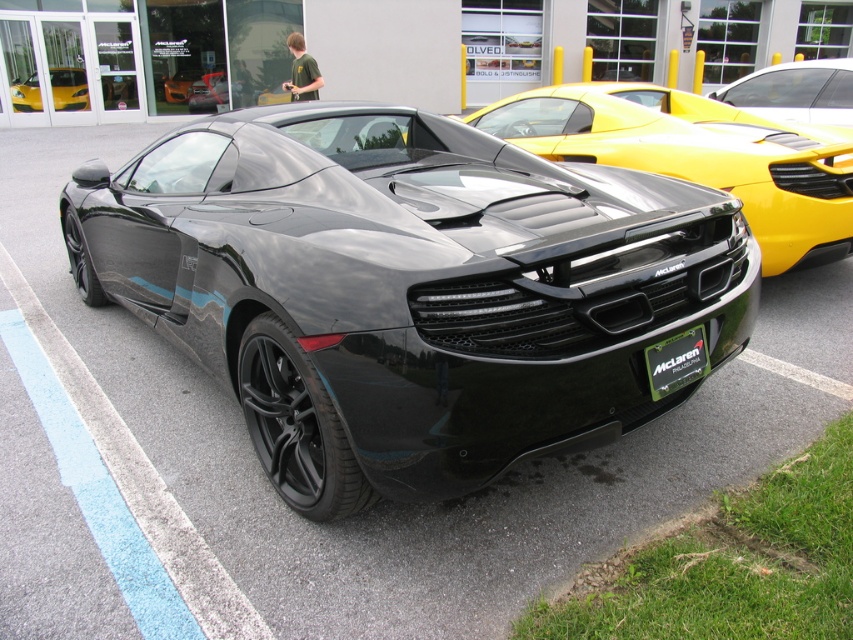
Describe the element at coordinates (212, 92) in the screenshot. I see `glossy black car at center` at that location.

Which is below, glossy black car at center or black matte sports car at center?

black matte sports car at center

Which is behind, point (189, 100) or point (286, 100)?

Positioned behind is point (189, 100).

At what (x,y) coordinates should I click in order to perform the action: click on glossy black car at center. Please return your answer as a coordinate pair (x, y). This screenshot has width=853, height=640. Looking at the image, I should click on (212, 92).

Is green matte license plate at rear thinner than glossy black car at center?

Indeed, green matte license plate at rear has a lesser width compared to glossy black car at center.

This screenshot has width=853, height=640. What do you see at coordinates (676, 362) in the screenshot?
I see `green matte license plate at rear` at bounding box center [676, 362].

Find the location of a particular element. green matte license plate at rear is located at coordinates (676, 362).

Is green matte license plate at rear bigger than black matte sports car at center?

Incorrect, green matte license plate at rear is not larger than black matte sports car at center.

This screenshot has height=640, width=853. In order to click on green matte license plate at rear in this screenshot , I will do `click(676, 362)`.